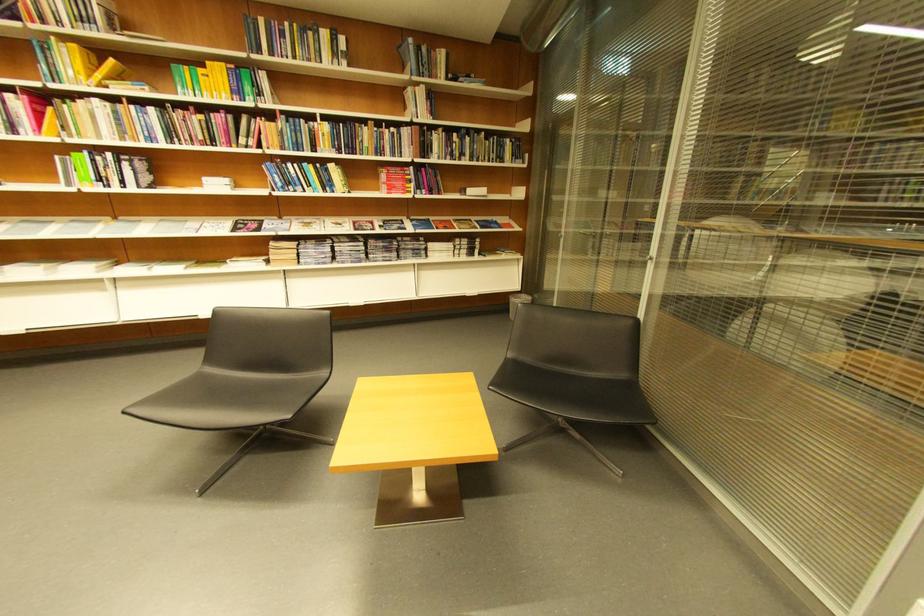
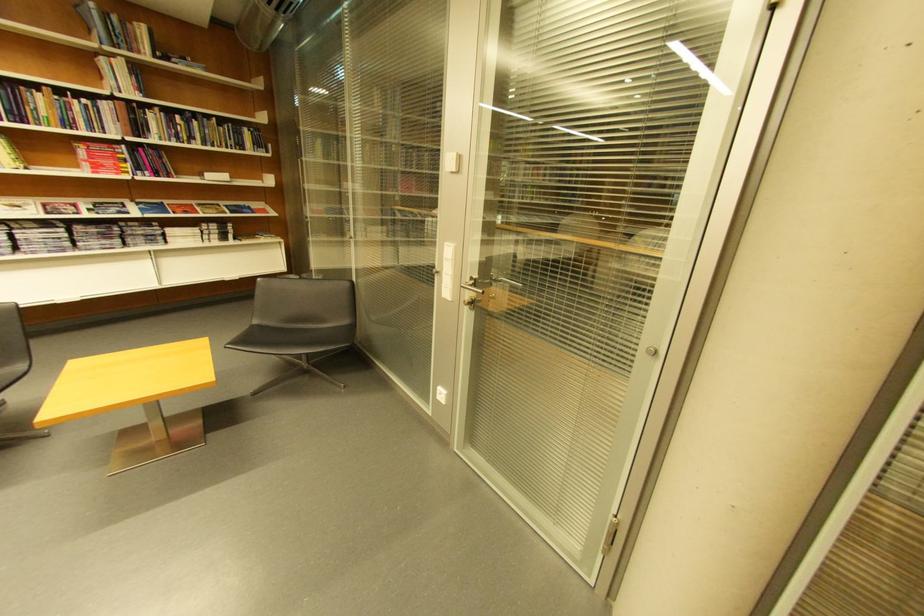
Where in the second image is the point corresponding to point 377,146 from the first image?

(54, 116)